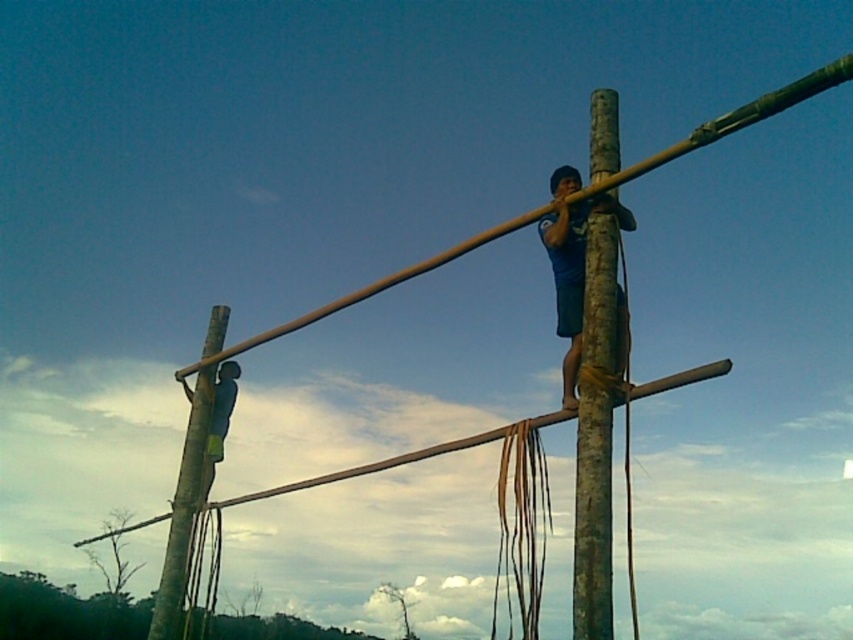
Is brown wood pole at center taller than brown wood pole at left?

Indeed, brown wood pole at center has a greater height compared to brown wood pole at left.

Between point (805, 92) and point (165, 634), which one is positioned behind?

Positioned behind is point (165, 634).

Between point (527, 218) and point (158, 598), which one is positioned behind?

The point (158, 598) is behind.

This screenshot has height=640, width=853. Identify the location of brown wood pole at center. (729, 124).

Does smooth bamboo pole at center have a lesser width compared to brown wood pole at center?

Yes, smooth bamboo pole at center is thinner than brown wood pole at center.

Does smooth bamboo pole at center appear under brown wood pole at center?

Indeed, smooth bamboo pole at center is positioned under brown wood pole at center.

Who is more forward, (608,632) or (276,330)?

Positioned in front is point (608,632).

Locate an element on the screen. smooth bamboo pole at center is located at coordinates (596, 429).

Can you confirm if blue fabric shirt at center is bigger than brown wood pole at left?

Actually, blue fabric shirt at center might be smaller than brown wood pole at left.

Does blue fabric shirt at center appear on the right side of brown wood pole at left?

Correct, you'll find blue fabric shirt at center to the right of brown wood pole at left.

Which is behind, point (572, 228) or point (178, 470)?

The point (178, 470) is behind.

Find the location of `blue fabric shirt at center`. blue fabric shirt at center is located at coordinates (572, 262).